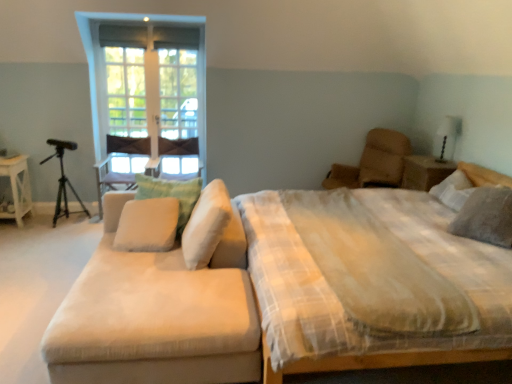
Question: Is gray textured pillow at right, the first pillow in the right-to-left sequence, next to clear glass door at upper center and touching it?

Choices:
 (A) no
 (B) yes

Answer: (A)

Question: Is gray textured pillow at right, the first pillow in the right-to-left sequence, bigger than clear glass door at upper center?

Choices:
 (A) yes
 (B) no

Answer: (B)

Question: Does gray textured pillow at right, arranged as the 4th pillow when viewed from the left, have a greater height compared to clear glass door at upper center?

Choices:
 (A) yes
 (B) no

Answer: (B)

Question: Considering the relative sizes of gray textured pillow at right, the first pillow in the right-to-left sequence, and clear glass door at upper center in the image provided, is gray textured pillow at right, the first pillow in the right-to-left sequence, smaller than clear glass door at upper center?

Choices:
 (A) yes
 (B) no

Answer: (A)

Question: Is gray textured pillow at right, arranged as the 4th pillow when viewed from the left, oriented towards clear glass door at upper center?

Choices:
 (A) no
 (B) yes

Answer: (A)

Question: From a real-world perspective, is gray textured pillow at right, arranged as the 4th pillow when viewed from the left, under clear glass door at upper center?

Choices:
 (A) yes
 (B) no

Answer: (A)

Question: Is leather swivel chair at upper right outside of beige fabric pillow at center, arranged as the first pillow when viewed from the left?

Choices:
 (A) yes
 (B) no

Answer: (A)

Question: Is leather swivel chair at upper right shorter than beige fabric pillow at center, arranged as the first pillow when viewed from the left?

Choices:
 (A) yes
 (B) no

Answer: (B)

Question: From a real-world perspective, does leather swivel chair at upper right sit lower than beige fabric pillow at center, arranged as the first pillow when viewed from the left?

Choices:
 (A) no
 (B) yes

Answer: (A)

Question: Is leather swivel chair at upper right touching beige fabric pillow at center, arranged as the first pillow when viewed from the left?

Choices:
 (A) no
 (B) yes

Answer: (A)

Question: Is leather swivel chair at upper right oriented towards beige fabric pillow at center, arranged as the first pillow when viewed from the left?

Choices:
 (A) yes
 (B) no

Answer: (A)

Question: Considering the relative positions of leather swivel chair at upper right and beige fabric pillow at center, arranged as the first pillow when viewed from the left, in the image provided, is leather swivel chair at upper right in front of beige fabric pillow at center, arranged as the first pillow when viewed from the left,?

Choices:
 (A) no
 (B) yes

Answer: (A)

Question: Is clear glass door at upper center with beige fabric couch at left?

Choices:
 (A) yes
 (B) no

Answer: (B)